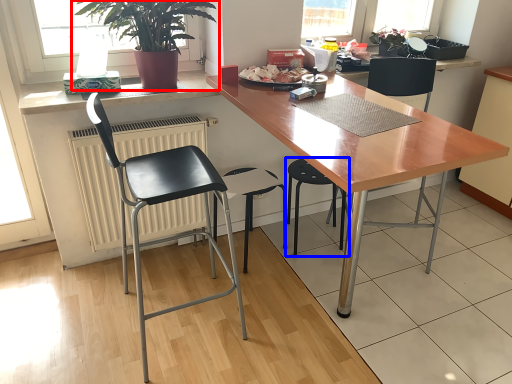
Question: Which object is further to the camera taking this photo, houseplant (highlighted by a red box) or chair (highlighted by a blue box)?

Choices:
 (A) houseplant
 (B) chair

Answer: (B)